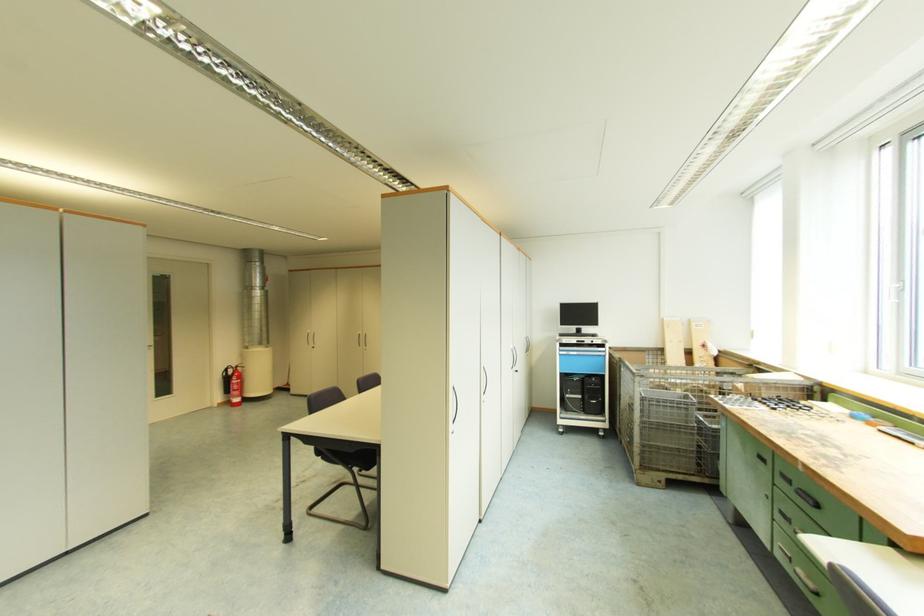
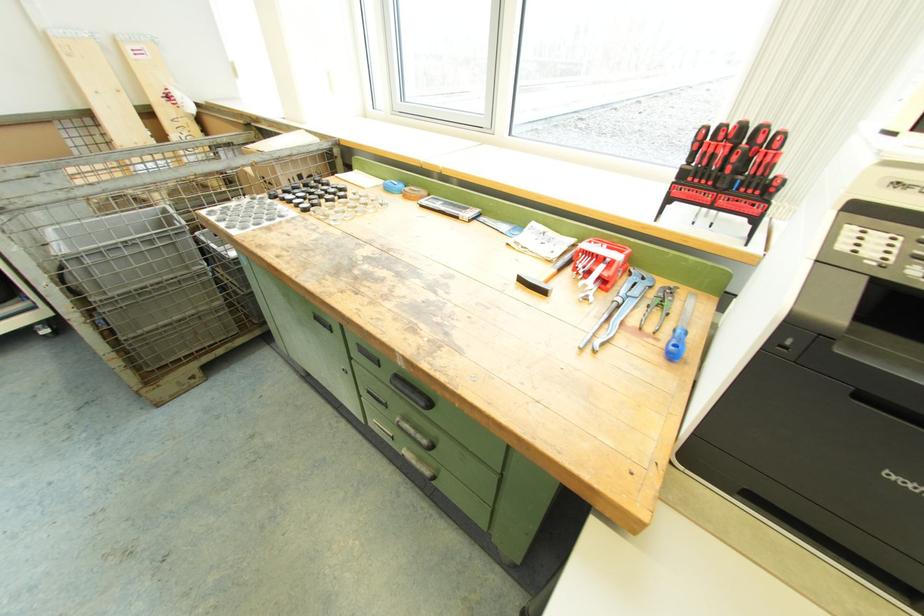
In the second image, find the point that corresponds to (690,422) in the first image.

(190, 268)